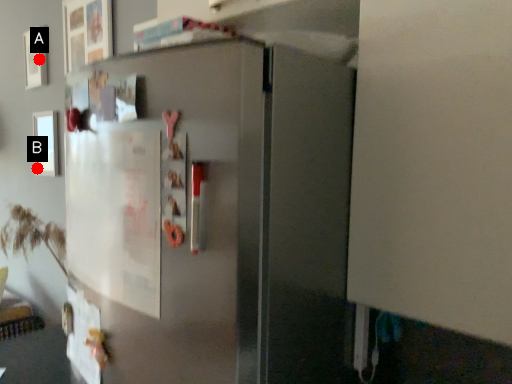
Question: Two points are circled on the image, labeled by A and B beside each circle. Which point is farther from the camera taking this photo?

Choices:
 (A) A is further
 (B) B is further

Answer: (B)